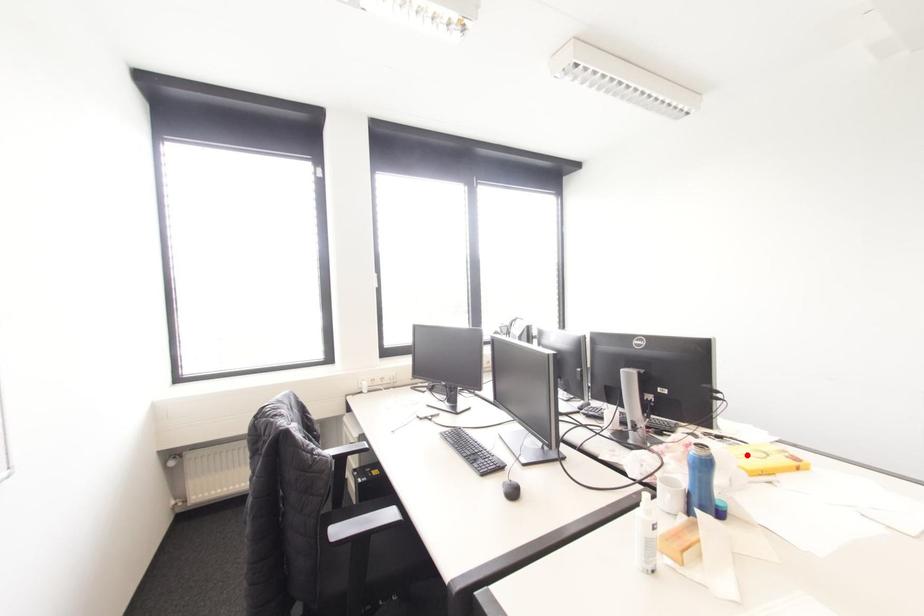
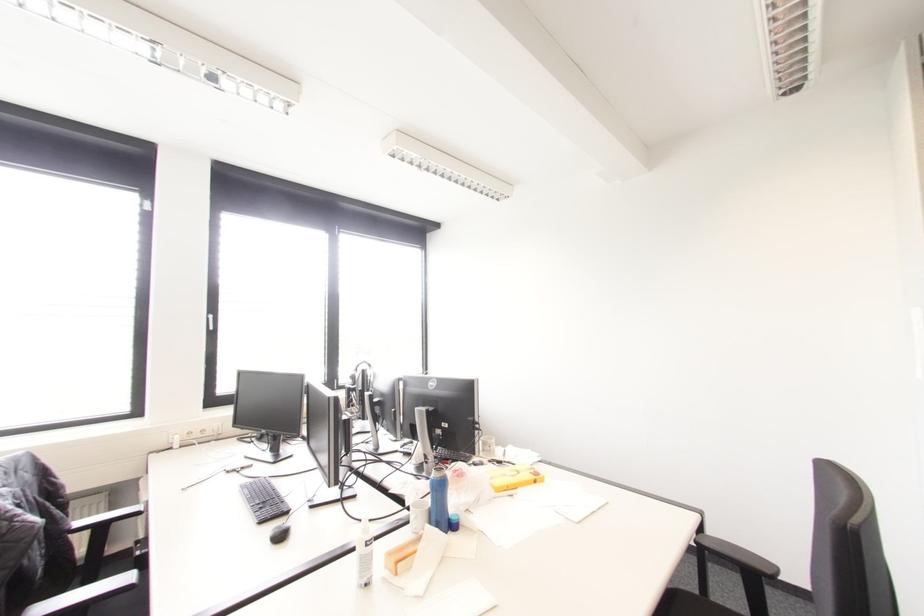
In the second image, find the point that corresponds to the highlighted location in the first image.

(504, 474)